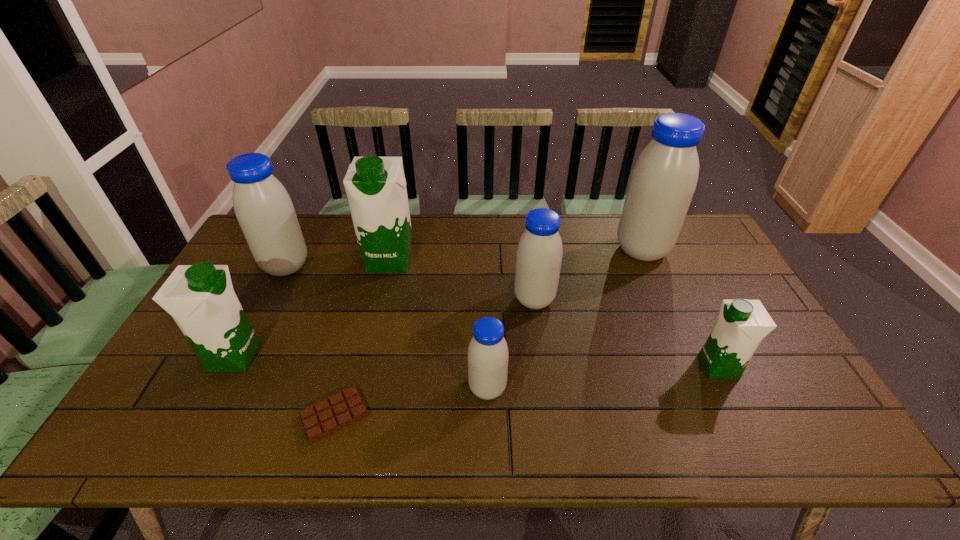
The height and width of the screenshot is (540, 960). I want to click on free area in between the leftmost green soya milk and the biggest blue soya milk, so [438, 303].

You are a GUI agent. You are given a task and a screenshot of the screen. Output one action in this format:
    pyautogui.click(x=<x>, y=<y>)
    Task: Click on the free space between the second smallest green soya milk and the second biggest blue soya milk
    The image size is (960, 540).
    Given the screenshot: What is the action you would take?
    pyautogui.click(x=260, y=311)

At what (x,y) coordinates should I click in order to perform the action: click on vacant space that's between the candy bar and the rightmost green soya milk. Please return your answer as a coordinate pair (x, y). Image resolution: width=960 pixels, height=540 pixels. Looking at the image, I should click on (527, 391).

Locate an element on the screen. free space that is in between the leftmost blue soya milk and the leftmost green soya milk is located at coordinates (260, 311).

At what (x,y) coordinates should I click in order to perform the action: click on vacant space in between the second smallest green soya milk and the farthest green soya milk. Please return your answer as a coordinate pair (x, y). The height and width of the screenshot is (540, 960). Looking at the image, I should click on (312, 308).

You are a GUI agent. You are given a task and a screenshot of the screen. Output one action in this format:
    pyautogui.click(x=<x>, y=<y>)
    Task: Click on the vacant space that's between the second biggest blue soya milk and the third object from right to left
    The height and width of the screenshot is (540, 960).
    Given the screenshot: What is the action you would take?
    pyautogui.click(x=410, y=283)

I want to click on free space between the second green soya milk from right to left and the biggest blue soya milk, so click(516, 255).

Identify the location of vacant area that lies between the second blue soya milk from left to right and the candy bar. (411, 402).

Select which object is the second closest to the fourth farthest soya milk. Please provide its 2D coordinates. Your answer should be formatted as a tuple, i.e. [(x, y)], where the tuple contains the x and y coordinates of a point satisfying the conditions above.

[(663, 181)]

You are a GUI agent. You are given a task and a screenshot of the screen. Output one action in this format:
    pyautogui.click(x=<x>, y=<y>)
    Task: Click on the seventh closest object to the third soya milk from left to right
    This screenshot has width=960, height=540.
    Given the screenshot: What is the action you would take?
    pyautogui.click(x=742, y=324)